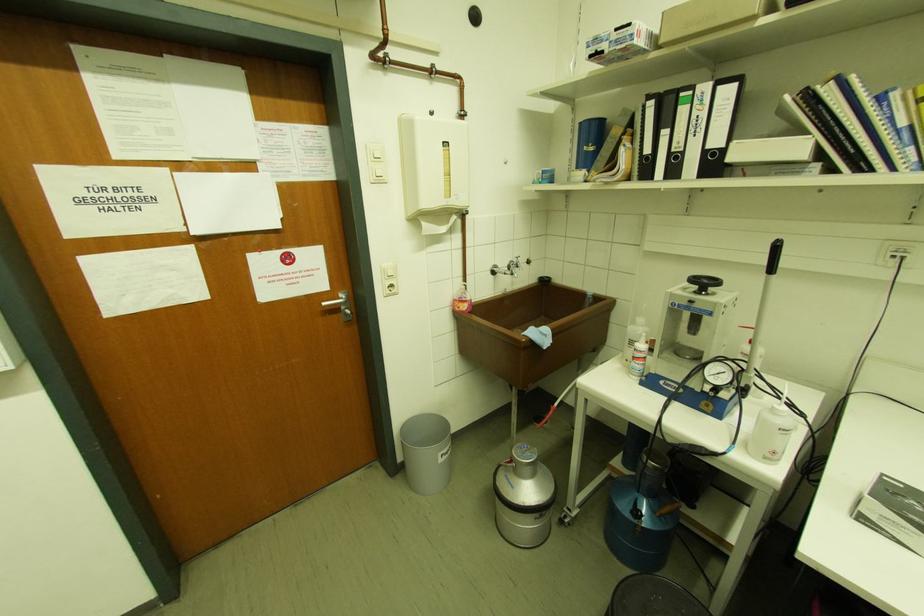
This screenshot has height=616, width=924. Describe the element at coordinates (515, 264) in the screenshot. I see `the faucet handle` at that location.